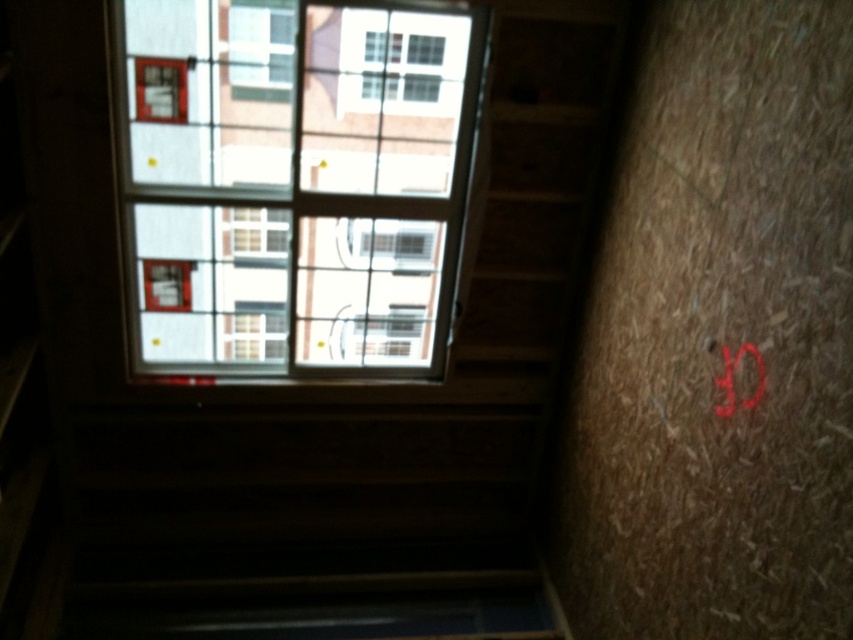
Who is lower down, transparent glass window at upper center or clear glass window at upper center?

Positioned lower is transparent glass window at upper center.

Who is positioned more to the left, transparent glass window at upper center or clear glass window at upper center?

Positioned to the left is clear glass window at upper center.

Describe the element at coordinates (308, 304) in the screenshot. I see `transparent glass window at upper center` at that location.

Where is `transparent glass window at upper center`? The image size is (853, 640). transparent glass window at upper center is located at coordinates point(308,304).

Does clear glass window at upper center have a larger size compared to red matte lettering at upper right?

Indeed, clear glass window at upper center has a larger size compared to red matte lettering at upper right.

Consider the image. Does clear glass window at upper center have a smaller size compared to red matte lettering at upper right?

Actually, clear glass window at upper center might be larger than red matte lettering at upper right.

Locate an element on the screen. Image resolution: width=853 pixels, height=640 pixels. clear glass window at upper center is located at coordinates pos(294,179).

Can you confirm if transparent glass window at upper center is smaller than red matte lettering at upper right?

Incorrect, transparent glass window at upper center is not smaller in size than red matte lettering at upper right.

Can you confirm if transparent glass window at upper center is taller than red matte lettering at upper right?

Correct, transparent glass window at upper center is much taller as red matte lettering at upper right.

The width and height of the screenshot is (853, 640). Identify the location of transparent glass window at upper center. (308, 304).

Locate an element on the screen. transparent glass window at upper center is located at coordinates (308, 304).